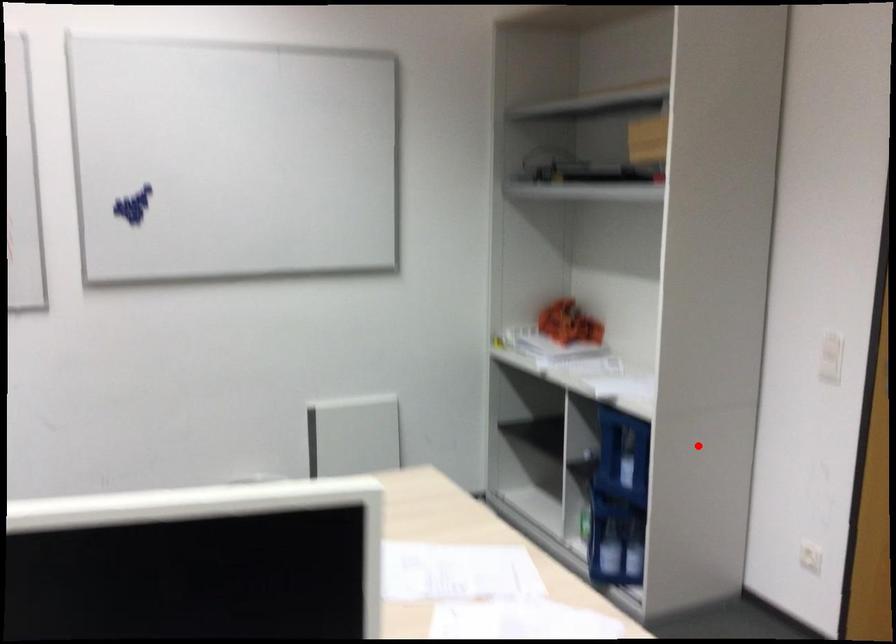
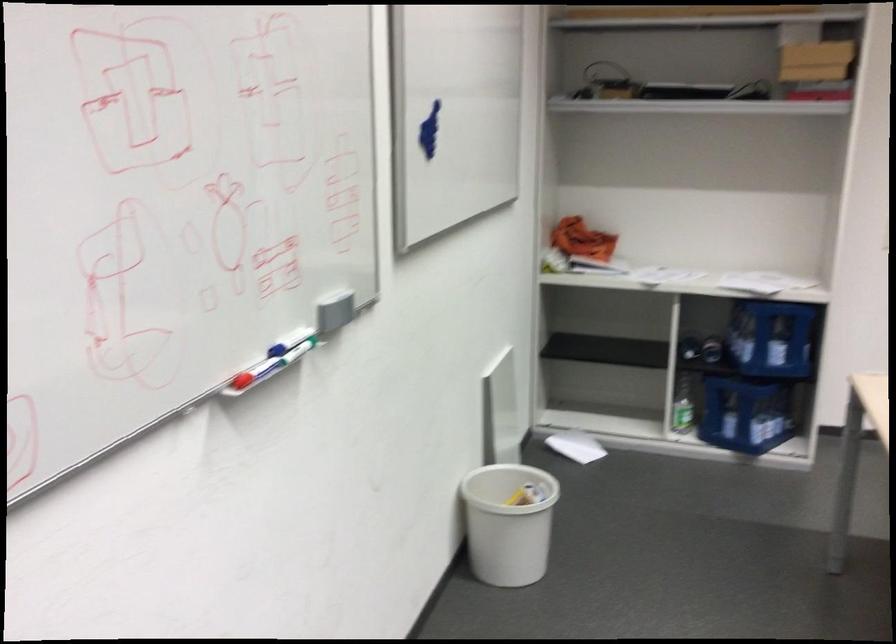
In the second image, find the point that corresponds to the highlighted location in the first image.

(771, 337)